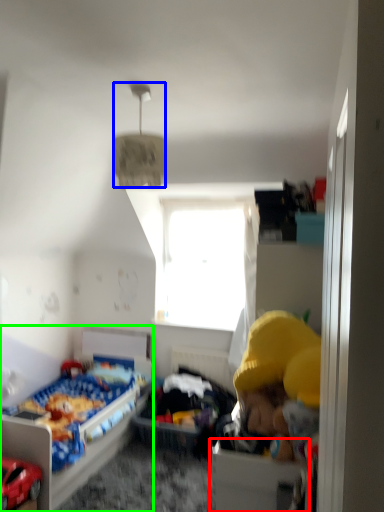
Question: Which object is positioned farthest from drawer (highlighted by a red box)? Select from lamp (highlighted by a blue box) and bed (highlighted by a green box).

Choices:
 (A) lamp
 (B) bed

Answer: (B)